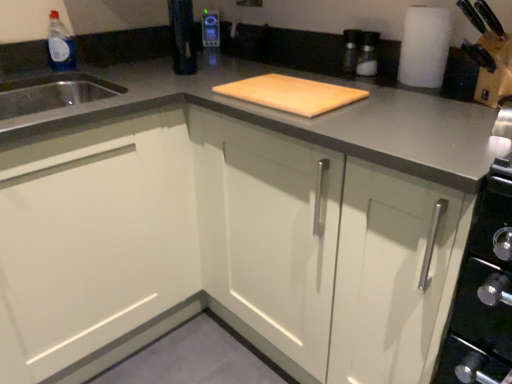
Question: Considering the positions of white matte paper towel at upper right and white matte cabinet at center, marked as the first cabinetry in a right-to-left arrangement, in the image, is white matte paper towel at upper right bigger or smaller than white matte cabinet at center, marked as the first cabinetry in a right-to-left arrangement,?

Choices:
 (A) big
 (B) small

Answer: (B)

Question: Is point (421, 24) closer or farther from the camera than point (181, 215)?

Choices:
 (A) farther
 (B) closer

Answer: (B)

Question: Which is nearer to the white matte paper towel at upper right?

Choices:
 (A) white matte cabinet at center, marked as the first cabinetry in a right-to-left arrangement
 (B) transparent plastic bottle at upper left
 (C) metallic silver toaster at upper center
 (D) natural wood cutting board at center
 (E) white matte cabinet at left, placed as the second cabinetry when sorted from right to left

Answer: (D)

Question: Estimate the real-world distances between objects in this image. Which object is closer to the white matte cabinet at left, placed as the second cabinetry when sorted from right to left?

Choices:
 (A) natural wood cutting board at center
 (B) white matte cabinet at center, marked as the first cabinetry in a right-to-left arrangement
 (C) metallic silver toaster at upper center
 (D) white matte paper towel at upper right
 (E) transparent plastic bottle at upper left

Answer: (B)